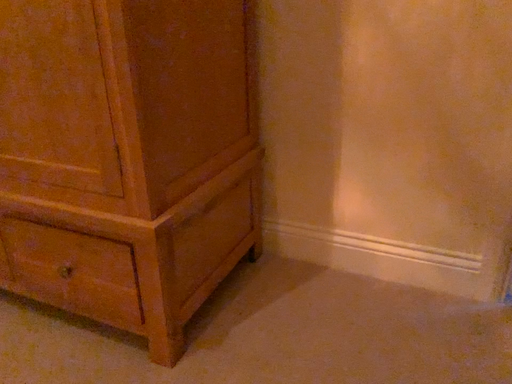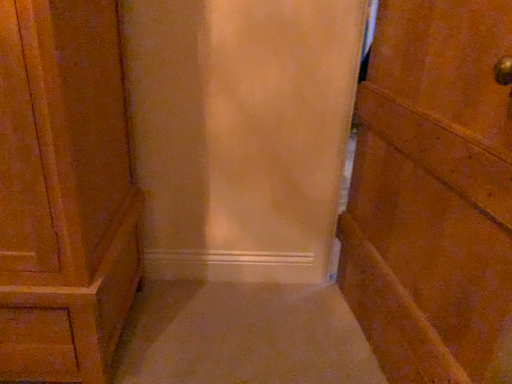
Question: How did the camera likely rotate when shooting the video?

Choices:
 (A) rotated left
 (B) rotated right

Answer: (B)